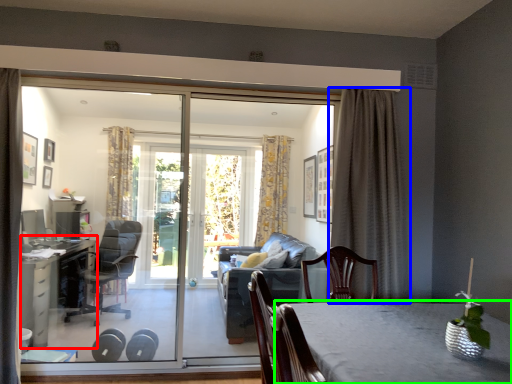
Question: Estimate the real-world distances between objects in this image. Which object is farther from table (highlighted by a red box), curtain (highlighted by a blue box) or table (highlighted by a green box)?

Choices:
 (A) curtain
 (B) table

Answer: (B)